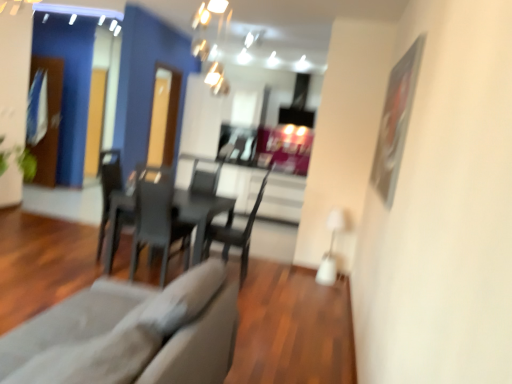
Question: Is transparent glass door at left, which ranks as the second glass door in right-to-left order, completely or partially outside of transparent glass door at center, positioned as the 2th glass door in left-to-right order?

Choices:
 (A) yes
 (B) no

Answer: (A)

Question: Is transparent glass door at left, the second glass door positioned from the front, positioned with its back to transparent glass door at center, arranged as the 1th glass door when viewed from the front?

Choices:
 (A) yes
 (B) no

Answer: (B)

Question: From the image's perspective, does transparent glass door at left, the second glass door positioned from the front, appear higher than transparent glass door at center, marked as the first glass door in a right-to-left arrangement?

Choices:
 (A) yes
 (B) no

Answer: (A)

Question: Does transparent glass door at left, the 1th glass door when ordered from back to front, have a greater height compared to transparent glass door at center, marked as the first glass door in a right-to-left arrangement?

Choices:
 (A) no
 (B) yes

Answer: (B)

Question: Does transparent glass door at left, which is the first glass door from left to right, have a greater width compared to transparent glass door at center, marked as the first glass door in a right-to-left arrangement?

Choices:
 (A) yes
 (B) no

Answer: (B)

Question: Considering the positions of matte gray armchair at center, arranged as the first armchair when viewed from the left, and matte black table at center in the image, is matte gray armchair at center, arranged as the first armchair when viewed from the left, taller or shorter than matte black table at center?

Choices:
 (A) tall
 (B) short

Answer: (A)

Question: Looking at their shapes, would you say matte gray armchair at center, arranged as the first armchair when viewed from the left, is wider or thinner than matte black table at center?

Choices:
 (A) wide
 (B) thin

Answer: (B)

Question: From the image's perspective, relative to matte black table at center, is matte gray armchair at center, the second armchair positioned from the right, above or below?

Choices:
 (A) below
 (B) above

Answer: (B)

Question: Based on their positions, is matte gray armchair at center, arranged as the first armchair when viewed from the left, located to the left or right of matte black table at center?

Choices:
 (A) left
 (B) right

Answer: (A)

Question: In the image, is transparent glass door at center, which is counted as the 2th glass door, starting from the back, positioned in front of or behind matte gray armchair at center, arranged as the first armchair when viewed from the left?

Choices:
 (A) front
 (B) behind

Answer: (B)

Question: From the image's perspective, is transparent glass door at center, positioned as the 2th glass door in left-to-right order, above or below matte gray armchair at center, the second armchair positioned from the right?

Choices:
 (A) above
 (B) below

Answer: (A)

Question: Looking at their shapes, would you say transparent glass door at center, positioned as the 2th glass door in left-to-right order, is wider or thinner than matte gray armchair at center, arranged as the first armchair when viewed from the left?

Choices:
 (A) wide
 (B) thin

Answer: (B)

Question: Considering the relative positions of transparent glass door at center, positioned as the 2th glass door in left-to-right order, and matte gray armchair at center, arranged as the first armchair when viewed from the left, in the image provided, is transparent glass door at center, positioned as the 2th glass door in left-to-right order, to the left or to the right of matte gray armchair at center, arranged as the first armchair when viewed from the left,?

Choices:
 (A) left
 (B) right

Answer: (A)

Question: Is matte black table at center inside the boundaries of matte black chair at center, the second armchair positioned from the left, or outside?

Choices:
 (A) inside
 (B) outside

Answer: (B)

Question: Is matte black table at center bigger or smaller than matte black chair at center, the 1th armchair in the right-to-left sequence?

Choices:
 (A) big
 (B) small

Answer: (A)